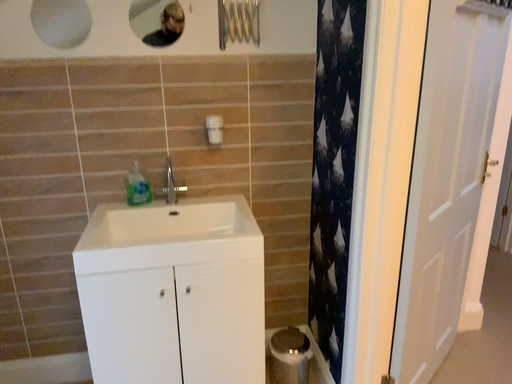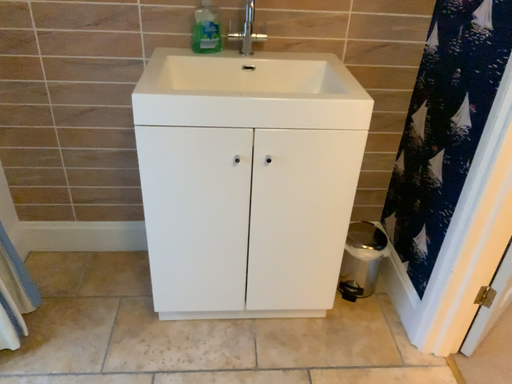
Question: Which way did the camera rotate in the video?

Choices:
 (A) rotated upward
 (B) rotated downward

Answer: (B)